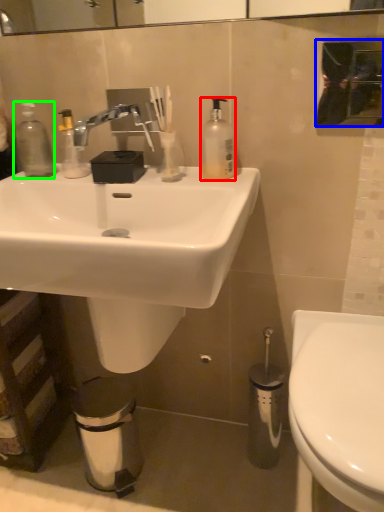
Question: Considering the real-world distances, which object is closest to soap dispenser (highlighted by a red box)? mirror (highlighted by a blue box) or bottle (highlighted by a green box).

Choices:
 (A) mirror
 (B) bottle

Answer: (A)